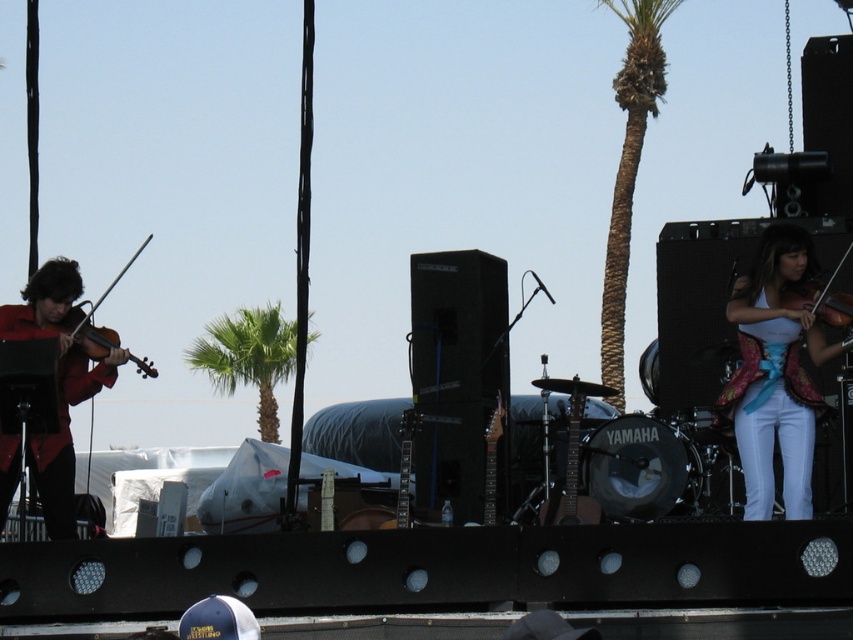
You are a stagehand who needs to adjust the microphone stand between the white satin vest at upper right and the matte black violin at center. Since the microphone stand requires 1 meter of space, can you place it there?

The white satin vest at upper right is positioned on the left side of matte black violin at center, but the exact distance between them isn not provided. Without knowing the distance, it is impossible to determine if there is enough space for the microphone stand requiring 1 meter.

You are a stagehand responsible for setting up the musical instruments. You need to place a new stand that can hold both the matte red violin at left and the shiny brown violin at left. Which violin requires a larger stand to accommodate its size?

The shiny brown violin at left requires a larger stand because it is bigger than the matte red violin at left.